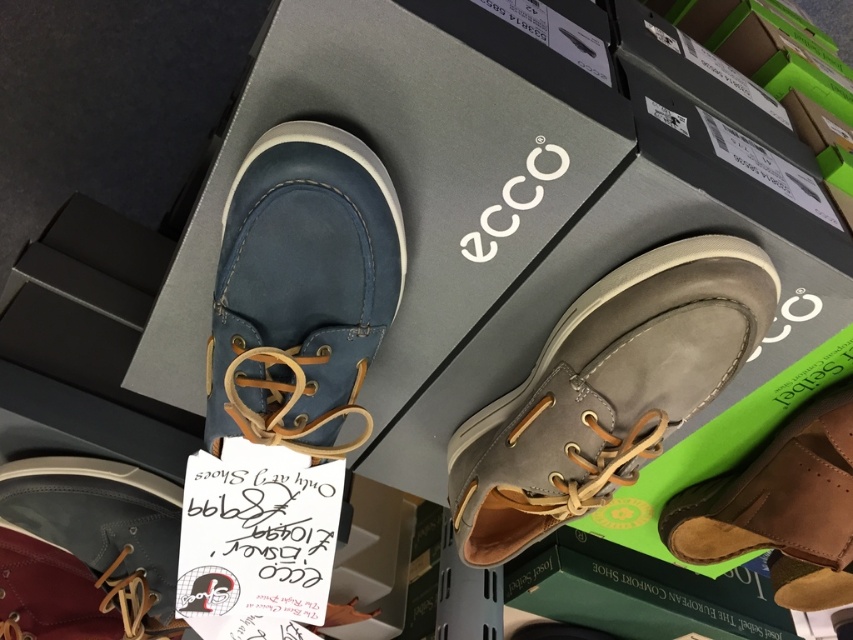
Does matte blue leather shoe at upper left have a greater width compared to brown leather shoe at lower right?

No, matte blue leather shoe at upper left is not wider than brown leather shoe at lower right.

Who is more distant from viewer, (317, 262) or (848, 554)?

Point (848, 554)

Which is behind, point (345, 276) or point (811, 564)?

The point (811, 564) is more distant.

The width and height of the screenshot is (853, 640). Find the location of `matte blue leather shoe at upper left`. matte blue leather shoe at upper left is located at coordinates (300, 289).

Is matte blue leather shoe at upper left to the left of matte leather shoe at lower left from the viewer's perspective?

In fact, matte blue leather shoe at upper left is to the right of matte leather shoe at lower left.

Does matte blue leather shoe at upper left appear over matte leather shoe at lower left?

Yes, matte blue leather shoe at upper left is above matte leather shoe at lower left.

The width and height of the screenshot is (853, 640). I want to click on matte blue leather shoe at upper left, so click(x=300, y=289).

Between matte leather shoe at lower left and brown leather shoe at lower right, which one is positioned higher?

Positioned higher is brown leather shoe at lower right.

Describe the element at coordinates (86, 550) in the screenshot. I see `matte leather shoe at lower left` at that location.

Where is `matte leather shoe at lower left`? This screenshot has height=640, width=853. matte leather shoe at lower left is located at coordinates (86, 550).